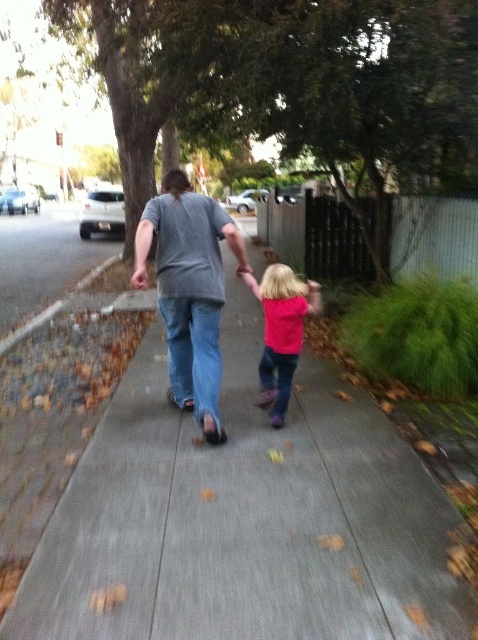
Question: Among these objects, which one is farthest from the camera?

Choices:
 (A) pink matte shirt at center
 (B) gray matte shirt at center
 (C) gray concrete sidewalk at center

Answer: (A)

Question: Is gray matte shirt at center further to the viewer compared to pink matte shirt at center?

Choices:
 (A) yes
 (B) no

Answer: (B)

Question: Which of the following is the closest to the observer?

Choices:
 (A) pink matte shirt at center
 (B) gray matte shirt at center

Answer: (B)

Question: Based on their relative distances, which object is nearer to the gray matte shirt at center?

Choices:
 (A) pink matte shirt at center
 (B) gray concrete sidewalk at center

Answer: (A)

Question: Does gray matte shirt at center appear over pink matte shirt at center?

Choices:
 (A) no
 (B) yes

Answer: (B)

Question: Is gray concrete sidewalk at center positioned in front of gray matte shirt at center?

Choices:
 (A) no
 (B) yes

Answer: (B)